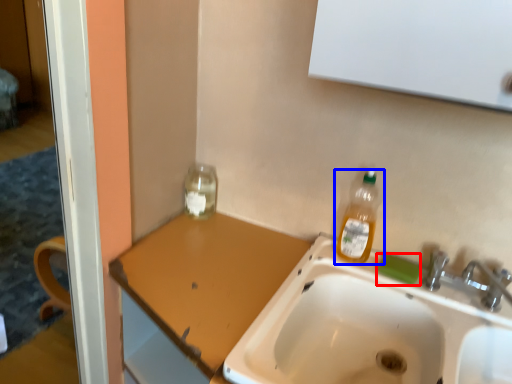
Question: Among these objects, which one is farthest to the camera, soap (highlighted by a red box) or bottle (highlighted by a blue box)?

Choices:
 (A) soap
 (B) bottle

Answer: (A)